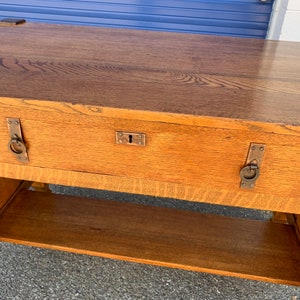
Where is `kinda gold handels`? kinda gold handels is located at coordinates (10, 142), (256, 157).